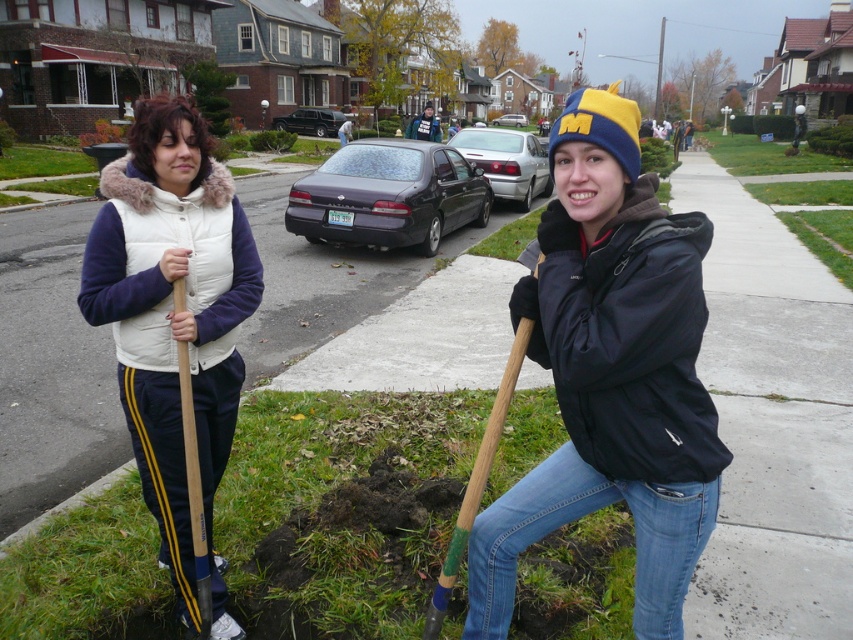
You are a drone operator who needs to deliver a small package to the white fleece vest at left. The delivery point is at coordinates point (173,317). Is the delivery point located on the white fleece vest at left?

Yes, the delivery point at point (173,317) is located on the white fleece vest at left.

You are a photographer trying to capture both the matte black jacket at center and the white fleece vest at left in a single frame. Given their sizes, which one should you focus on to ensure both are clearly visible in the photo?

Since the matte black jacket at center is smaller than the white fleece vest at left, you should focus on the matte black jacket at center to ensure both are clearly visible in the photo.

You are a photographer trying to capture both the matte black jacket at center and the white fleece vest at left in a single shot. Based on their heights, which person should you position closer to the camera to ensure both are fully visible in the frame?

Since the matte black jacket at center is shorter than the white fleece vest at left, you should position the matte black jacket at center closer to the camera to ensure both are fully visible in the frame.